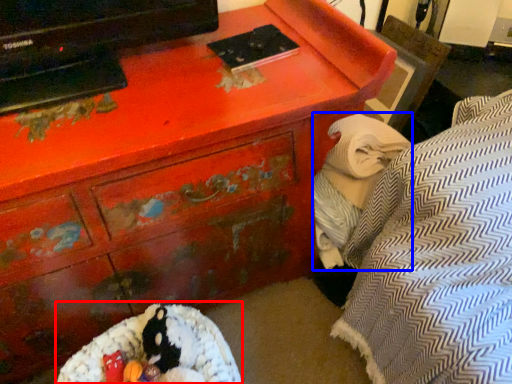
Question: Which point is closer to the camera, bean bag chair (highlighted by a red box) or blanket (highlighted by a blue box)?

Choices:
 (A) bean bag chair
 (B) blanket

Answer: (A)